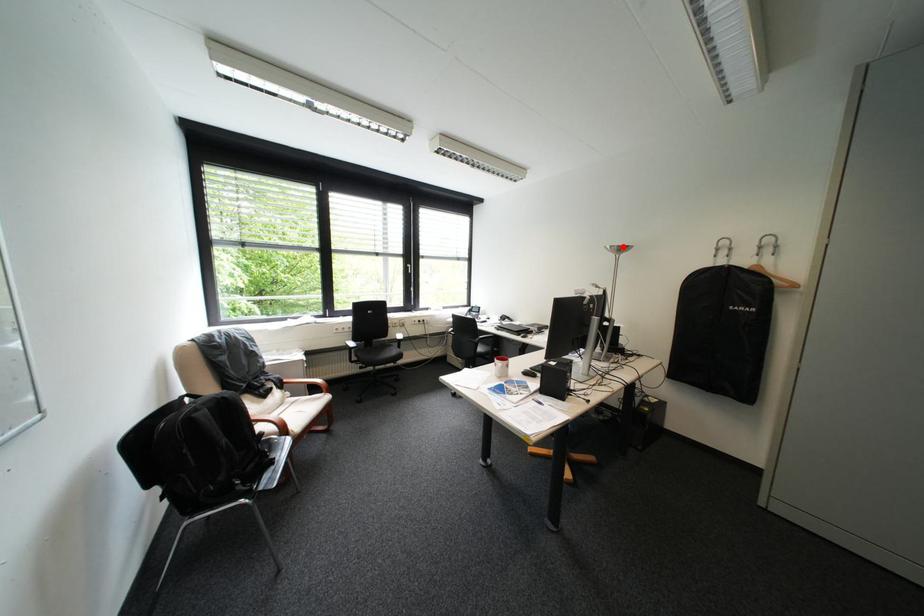
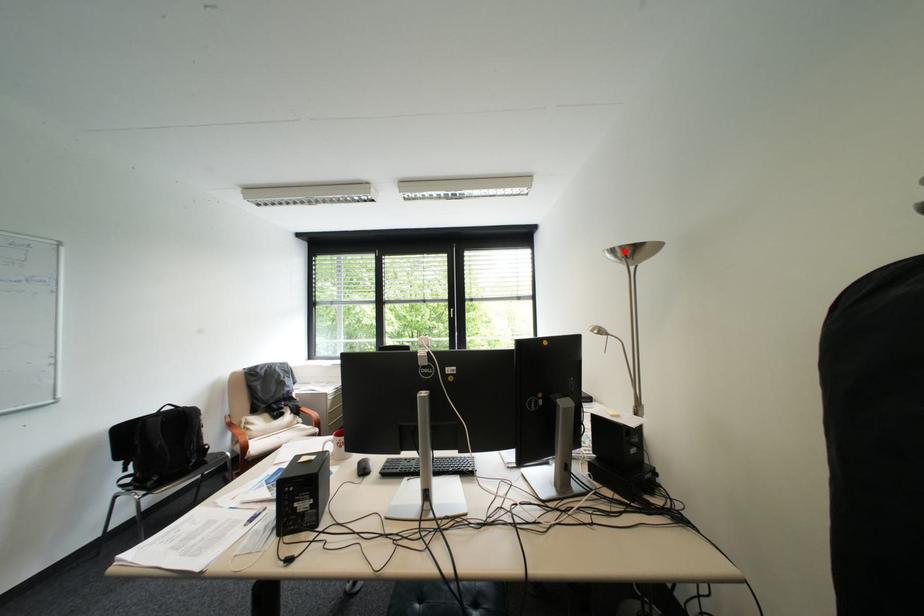
I am providing you with two images of the same scene from different viewpoints. A red point is marked on the first image and another point is marked on the second image. Are the points marked in image1 and image2 representing the same 3D position?

Yes